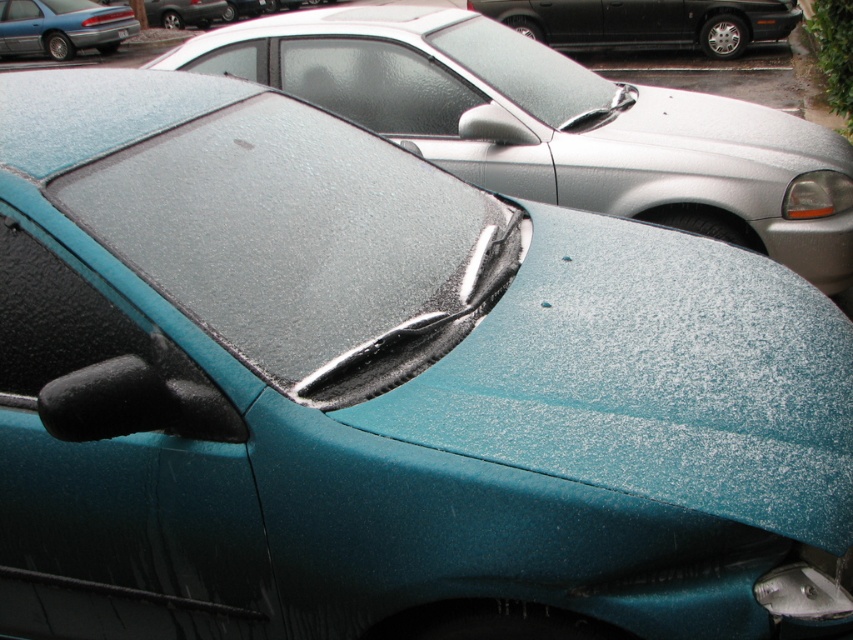
You are a delivery person trying to read the black plastic license plate at center on the teal car. You notice the glossy plastic windshield at center is in your line of sight. Which object is positioned to the right of the other?

The glossy plastic windshield at center is to the right of the black plastic license plate at center.

Consider the image. You are standing in the parking lot and see two points marked on the teal car. The first point is at coordinates point (381, 54) and the second is at point (550, 51). Which point is closer to you?

Point (381, 54) is closer to the viewer than point (550, 51).